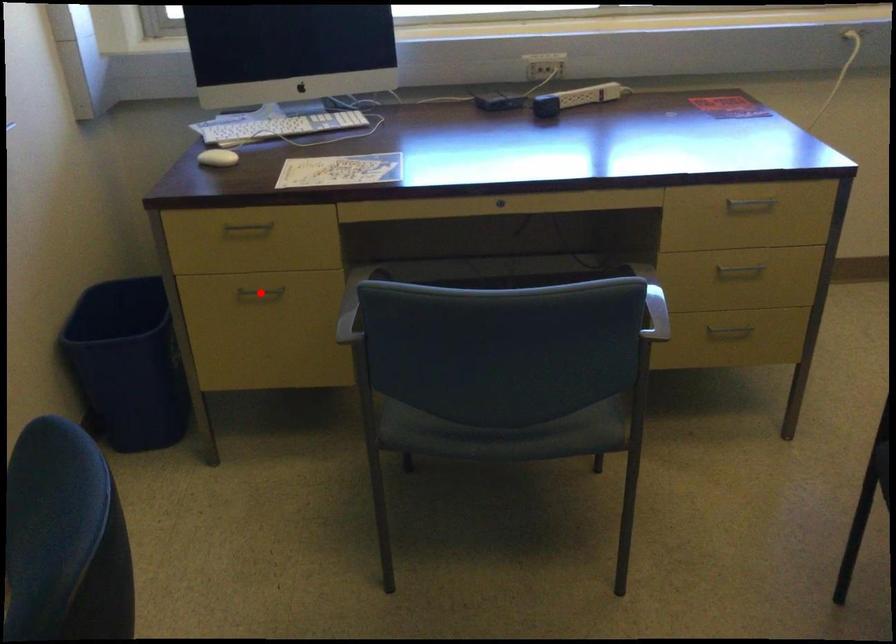
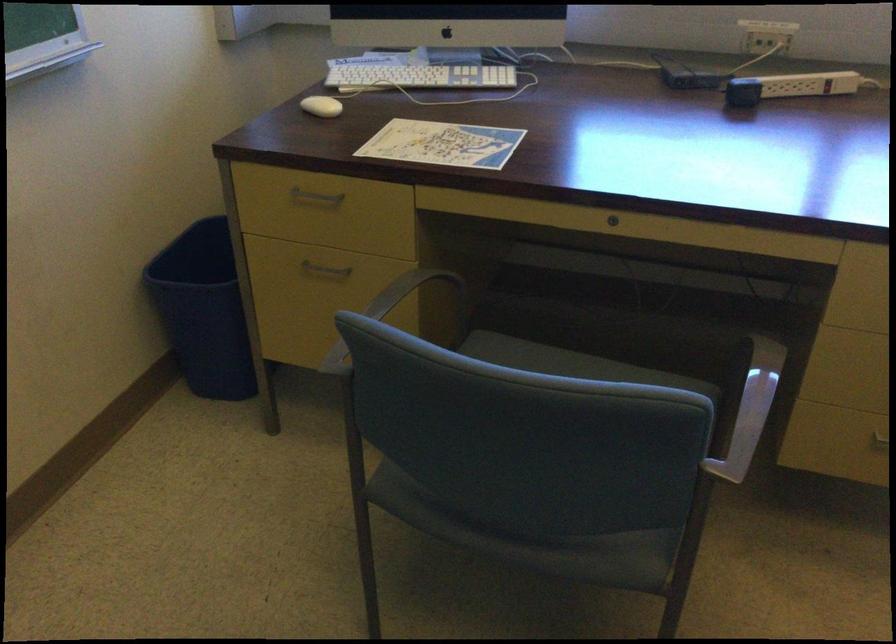
Find the pixel in the second image that matches the highlighted location in the first image.

(324, 269)